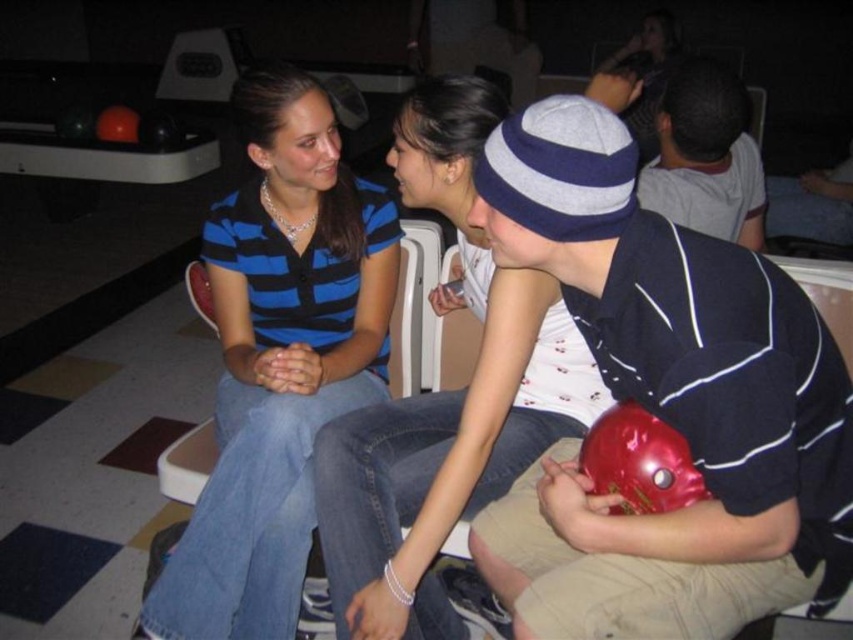
Between matte blue shirt at center and gray cotton shirt at upper right, which one is positioned higher?

gray cotton shirt at upper right is higher up.

Is matte blue shirt at center smaller than gray cotton shirt at upper right?

Incorrect, matte blue shirt at center is not smaller in size than gray cotton shirt at upper right.

Describe the element at coordinates (445, 392) in the screenshot. I see `matte blue shirt at center` at that location.

Locate an element on the screen. The height and width of the screenshot is (640, 853). matte blue shirt at center is located at coordinates (445, 392).

Who is positioned more to the left, shiny red bowling ball at center or blue striped shirt at center?

blue striped shirt at center

Is point (506, 252) more distant than point (219, 250)?

No.

Where is `shiny red bowling ball at center`? This screenshot has width=853, height=640. shiny red bowling ball at center is located at coordinates (663, 404).

Does shiny red bowling ball at center appear over matte blue shirt at center?

No.

Is point (753, 282) more distant than point (395, 515)?

No, it is not.

Between point (535, 216) and point (373, 456), which one is positioned in front?

Point (535, 216) is in front.

Where is `shiny red bowling ball at center`? shiny red bowling ball at center is located at coordinates (663, 404).